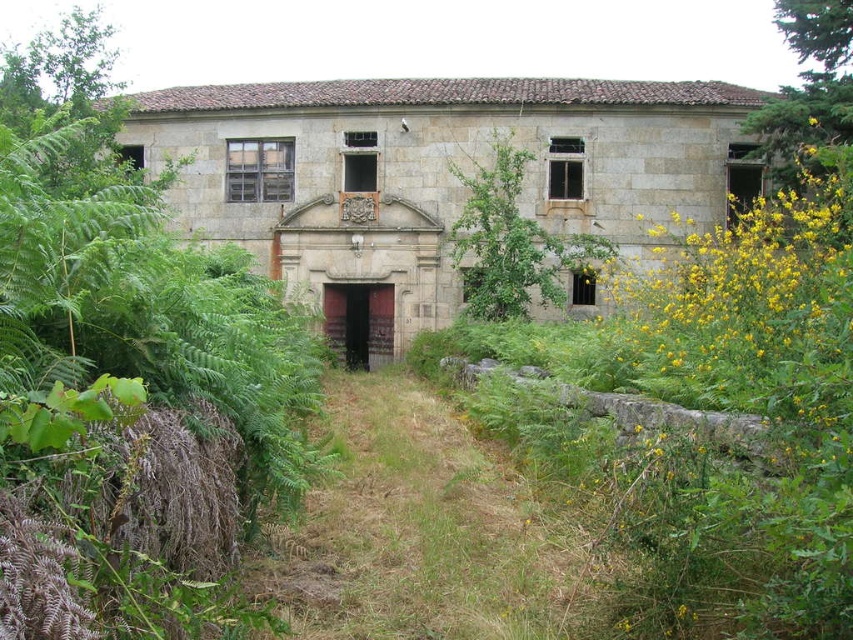
You are a gardener assessing the growth of plants around an old stone building. You notice the green leafy plant at left and the green leafy shrub at center. Which one is taller?

→ The green leafy plant at left is taller than the green leafy shrub at center.

You are a botanist examining the old stone building. You notice the green leafy plant at left and the green leafy shrub at center. Which one is positioned lower in the image?

The green leafy plant at left is positioned lower than the green leafy shrub at center.

You are standing at the entrance of the old stone building and see two points marked on the building. The first point is at coordinate point (735, 467) and the second is at point (486, 273). Which point is closer to you?

Point (735, 467) is in front of point (486, 273), so it is closer to you.